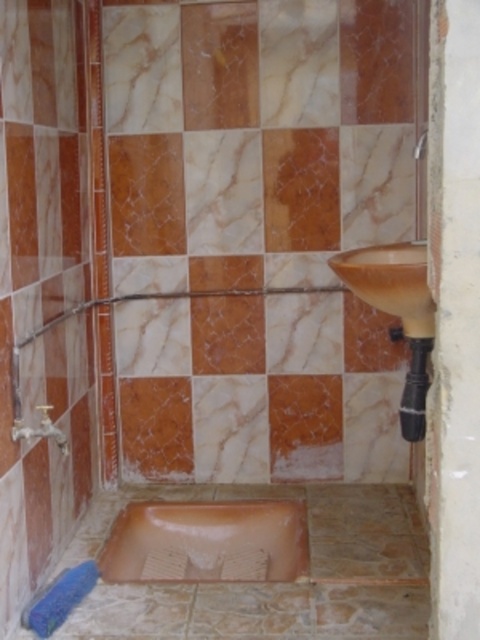
Measure the distance from matte brown bathtub at lower center to matte orange sink at center.

The distance of matte brown bathtub at lower center from matte orange sink at center is 3.67 feet.

Does matte brown bathtub at lower center have a lesser height compared to matte orange sink at center?

Yes, matte brown bathtub at lower center is shorter than matte orange sink at center.

Between point (149, 577) and point (404, 294), which one is positioned in front?

Point (404, 294) is more forward.

This screenshot has height=640, width=480. Identify the location of matte brown bathtub at lower center. (207, 541).